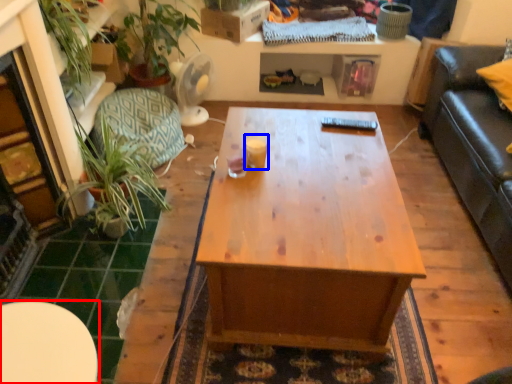
Question: Among these objects, which one is nearest to the camera, table (highlighted by a red box) or coffee cup (highlighted by a blue box)?

Choices:
 (A) table
 (B) coffee cup

Answer: (A)